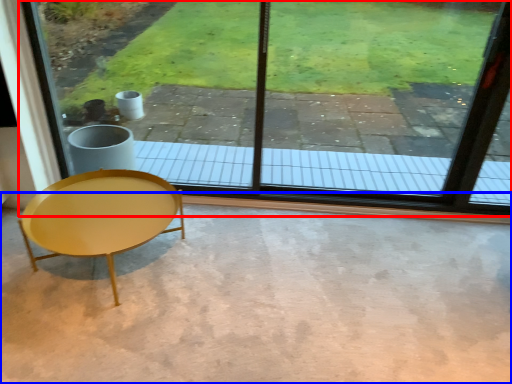
Question: Which object is closer to the camera taking this photo, window (highlighted by a red box) or concrete (highlighted by a blue box)?

Choices:
 (A) window
 (B) concrete

Answer: (B)